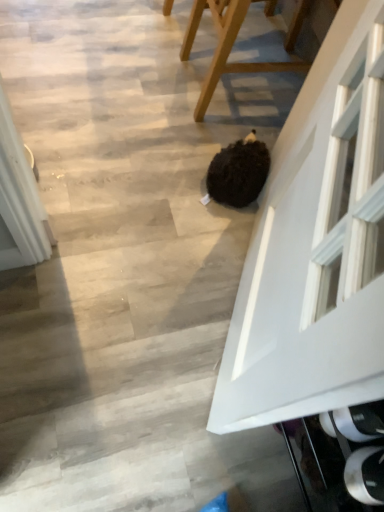
Where is `free spot to the left of white glossy door at center`? free spot to the left of white glossy door at center is located at coordinates (x=135, y=309).